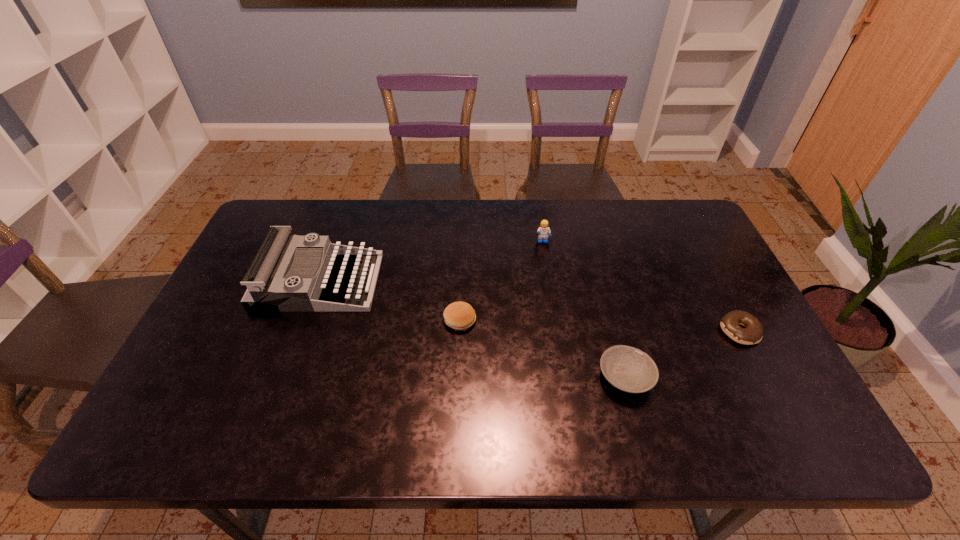
Image resolution: width=960 pixels, height=540 pixels. In order to click on vacant area at the far left corner of the desktop in this screenshot , I will do `click(261, 238)`.

What are the coordinates of `vacant area between the typewriter and the Lego` in the screenshot? It's located at (431, 261).

The height and width of the screenshot is (540, 960). In order to click on vacant space that is in between the leftmost object and the Lego in this screenshot , I will do `click(431, 261)`.

Locate an element on the screen. free space between the patty and the doughnut is located at coordinates (600, 326).

The width and height of the screenshot is (960, 540). I want to click on unoccupied area between the leftmost object and the patty, so click(390, 301).

Where is `vacant area between the typewriter and the bowl`? This screenshot has width=960, height=540. vacant area between the typewriter and the bowl is located at coordinates (472, 329).

You are a GUI agent. You are given a task and a screenshot of the screen. Output one action in this format:
    pyautogui.click(x=<x>, y=<y>)
    Task: Click on the vacant region between the doughnut and the fourth object from left to right
    
    Given the screenshot: What is the action you would take?
    pyautogui.click(x=683, y=354)

At what (x,y) coordinates should I click in order to perform the action: click on free space between the fourth object from left to right and the farthest object. Please return your answer as a coordinate pair (x, y). Image resolution: width=960 pixels, height=540 pixels. Looking at the image, I should click on (584, 309).

Locate an element on the screen. The width and height of the screenshot is (960, 540). free space between the tallest object and the patty is located at coordinates (390, 301).

The width and height of the screenshot is (960, 540). I want to click on vacant region between the rightmost object and the nearest object, so click(683, 354).